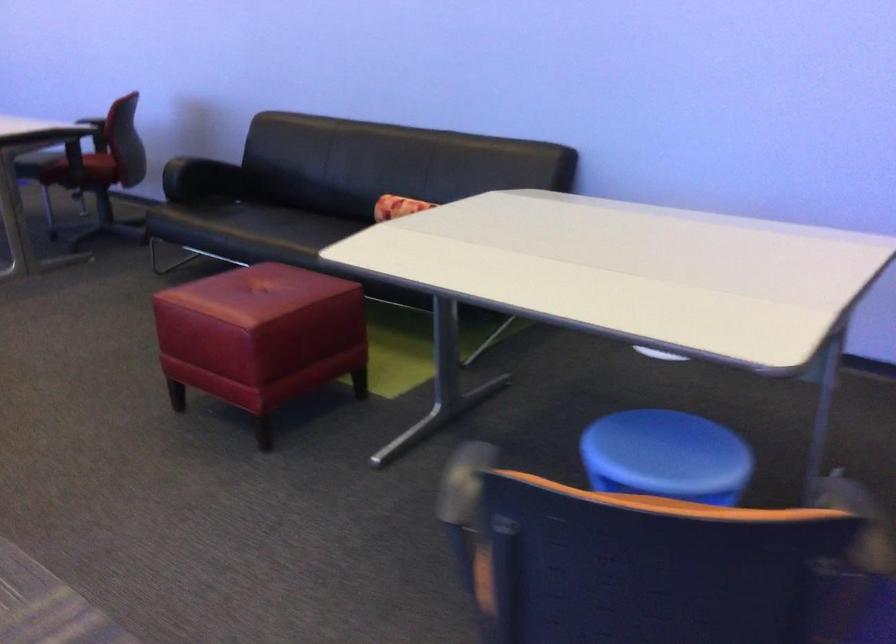
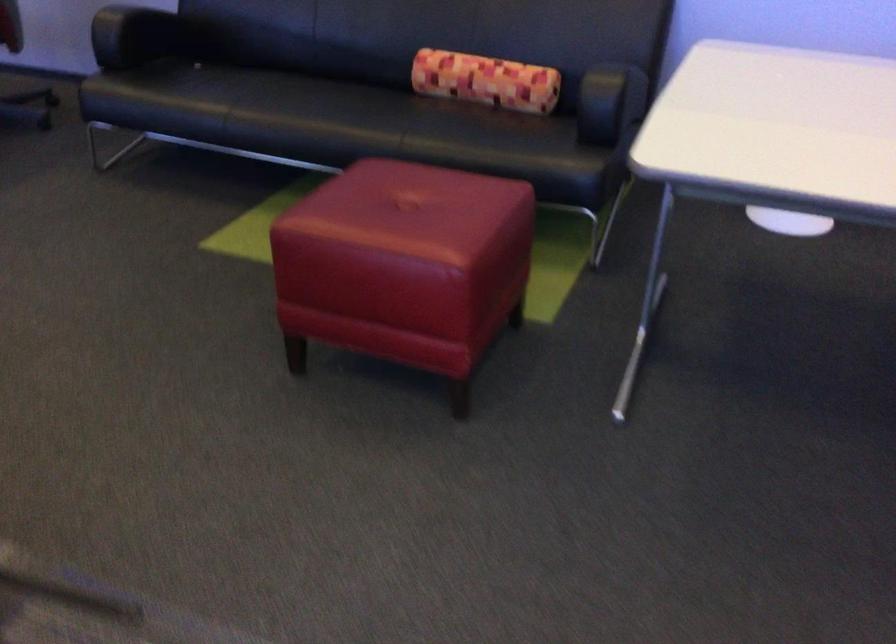
Which direction would the cameraman need to move to produce the second image?

The cameraman walked toward left, forward.